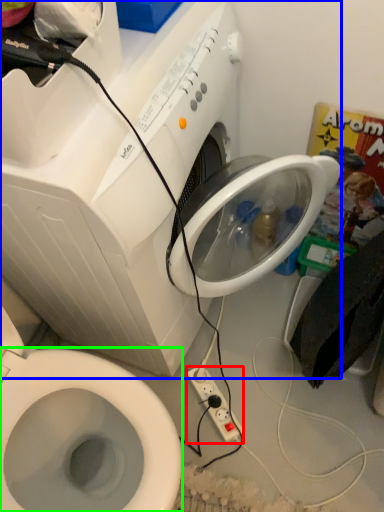
Question: Based on their relative distances, which object is nearer to power plugs and sockets (highlighted by a red box)? Choose from washing machine (highlighted by a blue box) and bidet (highlighted by a green box).

Choices:
 (A) washing machine
 (B) bidet

Answer: (B)